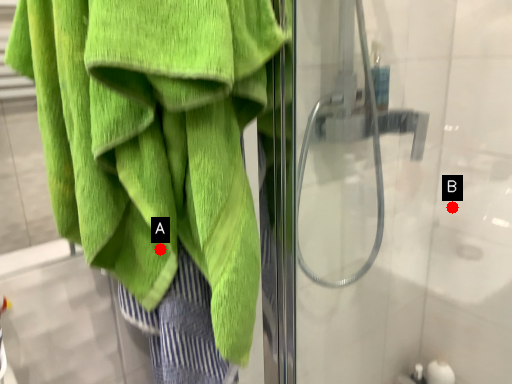
Question: Two points are circled on the image, labeled by A and B beside each circle. Among these points, which one is farthest from the camera?

Choices:
 (A) A is further
 (B) B is further

Answer: (B)